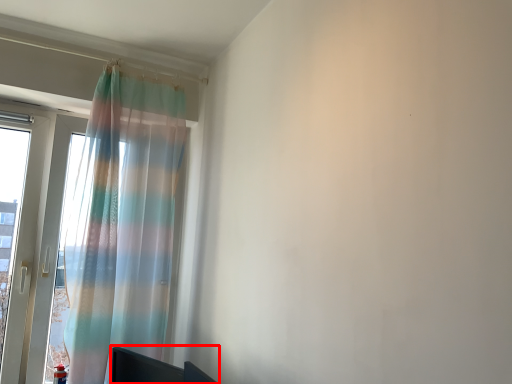
Question: From the image, what is the correct spatial relationship of furniture (annotated by the red box) in relation to curtain?

Choices:
 (A) left
 (B) right

Answer: (B)